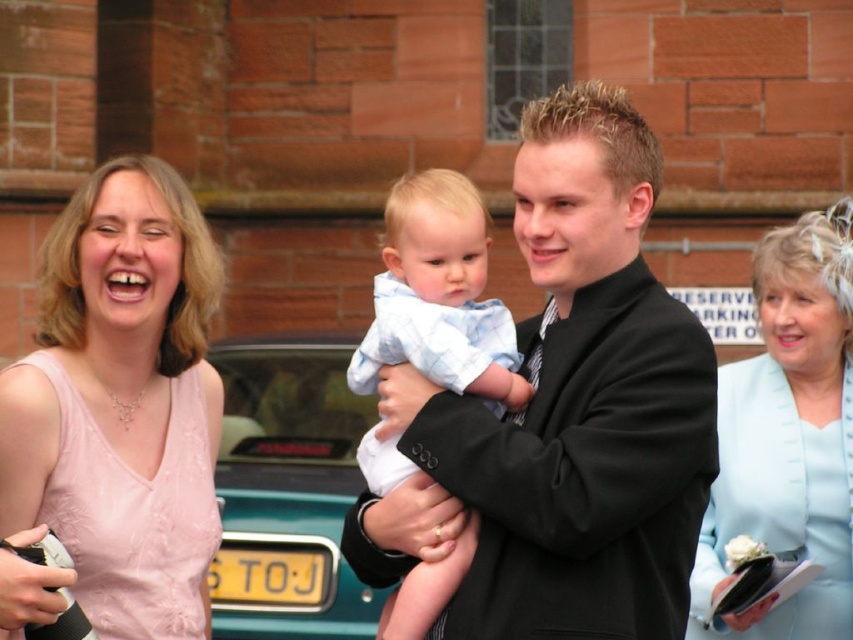
Question: Can you confirm if black suit at center is positioned to the right of pink satin dress at upper left?

Choices:
 (A) no
 (B) yes

Answer: (B)

Question: Which of the following is the farthest from the observer?

Choices:
 (A) light blue satin dress at center
 (B) black suit at center

Answer: (A)

Question: Is pink satin dress at upper left thinner than light blue cotton shirt at center?

Choices:
 (A) no
 (B) yes

Answer: (B)

Question: Among these objects, which one is farthest from the camera?

Choices:
 (A) black suit at center
 (B) green metallic car at center
 (C) light blue satin dress at center
 (D) pink satin dress at upper left

Answer: (B)

Question: Where is light blue satin dress at center located in relation to light blue cotton shirt at center in the image?

Choices:
 (A) right
 (B) left

Answer: (A)

Question: Estimate the real-world distances between objects in this image. Which object is closer to the pink satin dress at upper left?

Choices:
 (A) black suit at center
 (B) light blue cotton shirt at center

Answer: (B)